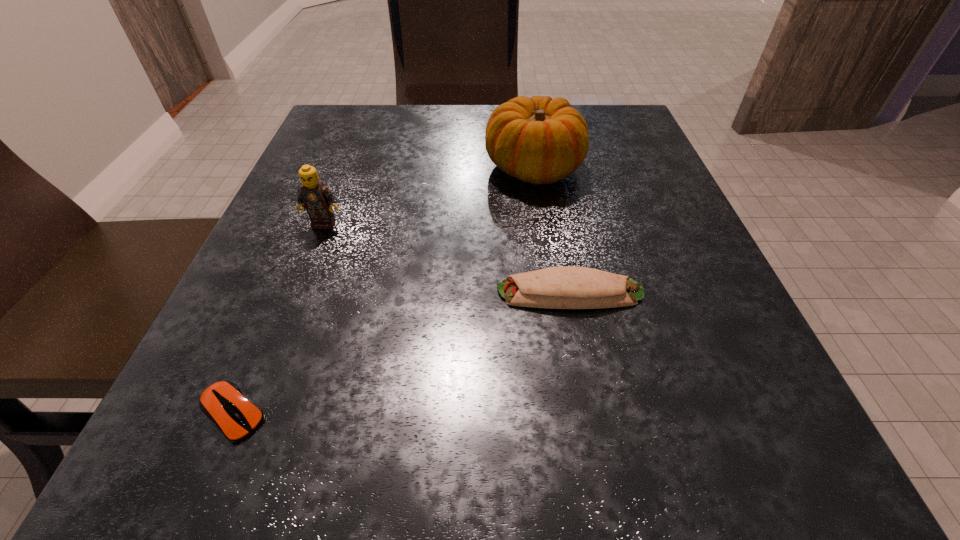
Locate an element on the screen. This screenshot has width=960, height=540. free point at the far edge is located at coordinates (462, 114).

In the image, there is a desktop. In order to click on vacant space at the near edge in this screenshot , I will do `click(631, 472)`.

You are a GUI agent. You are given a task and a screenshot of the screen. Output one action in this format:
    pyautogui.click(x=<x>, y=<y>)
    Task: Click on the vacant space at the left edge of the desktop
    Image resolution: width=960 pixels, height=540 pixels.
    Given the screenshot: What is the action you would take?
    pyautogui.click(x=342, y=187)

This screenshot has height=540, width=960. In the image, there is a desktop. Find the location of `vacant space at the right edge`. vacant space at the right edge is located at coordinates (710, 285).

Locate an element on the screen. Image resolution: width=960 pixels, height=540 pixels. vacant space at the far left corner is located at coordinates (x=351, y=147).

In the image, there is a desktop. Where is `free space at the near left corner`? free space at the near left corner is located at coordinates (274, 447).

Locate an element on the screen. free space at the far right corner of the desktop is located at coordinates (590, 130).

Identify the location of free location at the near right corner. The width and height of the screenshot is (960, 540). (734, 438).

I want to click on vacant space that is in between the gourd and the nearest object, so click(x=384, y=291).

Where is `free area in between the farthest object and the second farthest object`? free area in between the farthest object and the second farthest object is located at coordinates (429, 196).